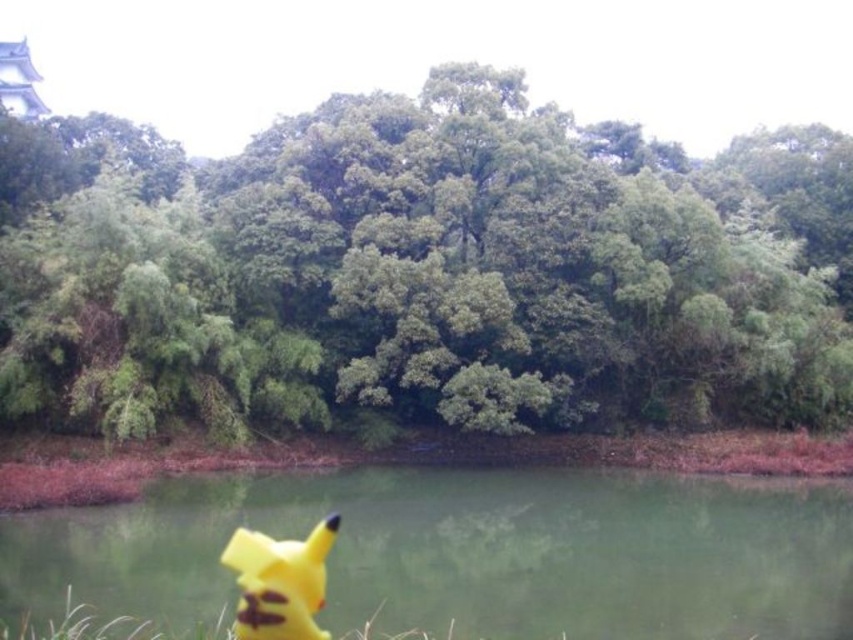
You are a photographer setting up a shot of the yellow fabric pikachu at lower center and the yellow matte pikachu at lower left. Which Pikachu should you zoom in on to capture more details without moving the camera, considering their sizes?

The yellow fabric pikachu at lower center has a greater width than the yellow matte pikachu at lower left, so zooming in on the yellow fabric pikachu at lower center would allow you to capture more details without moving the camera since it is larger.